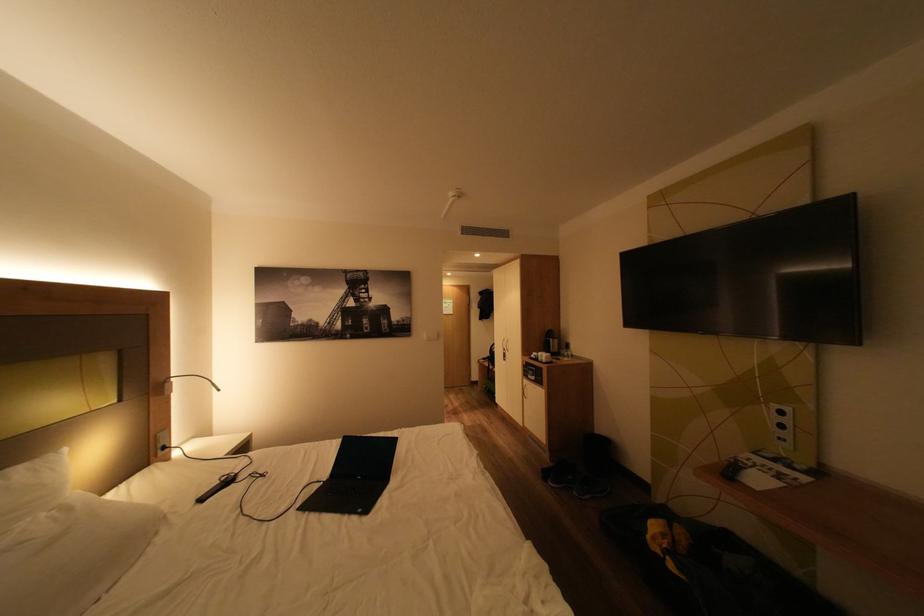
Which object does [216,487] point to?

It refers to a black remote control.